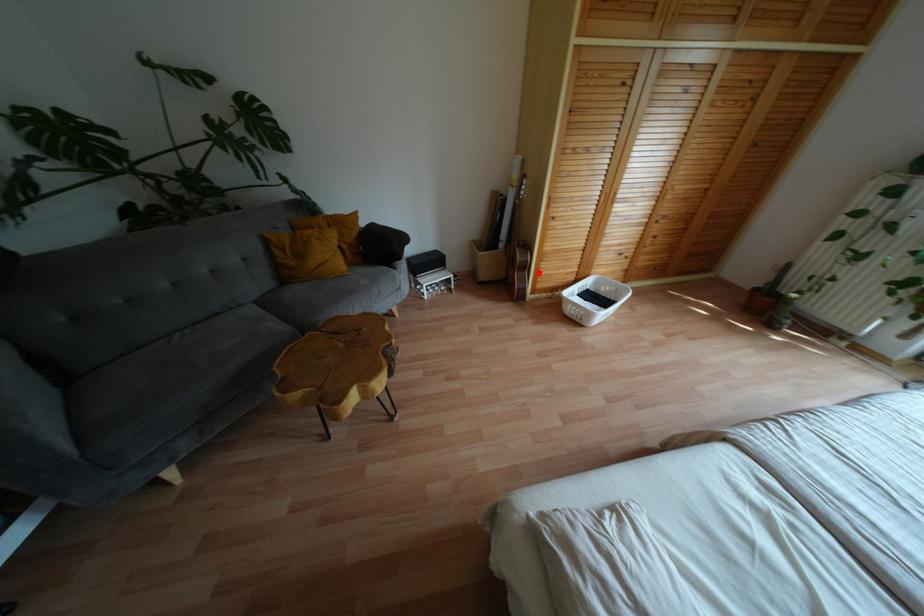
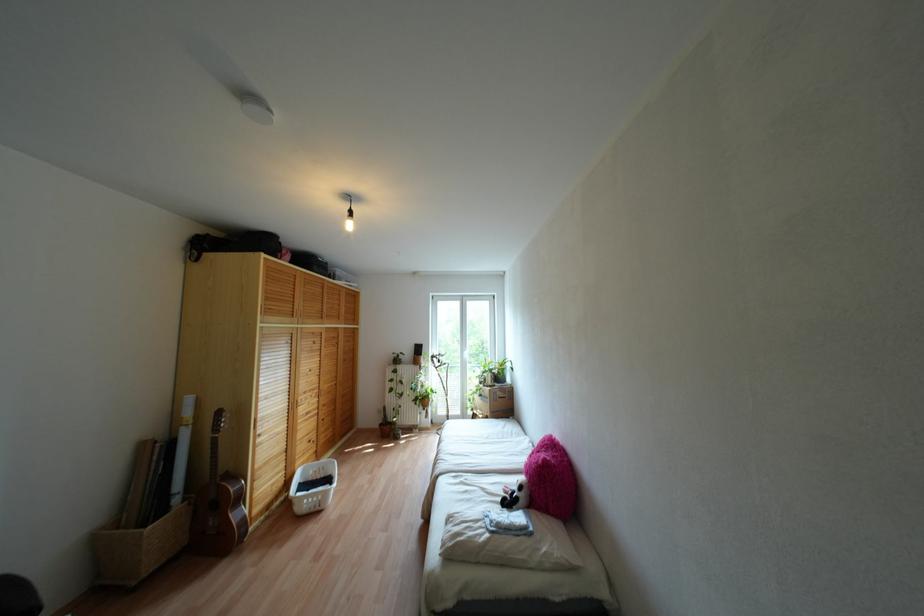
Where in the second image is the point corresponding to the highlighted location from the first image?

(253, 495)